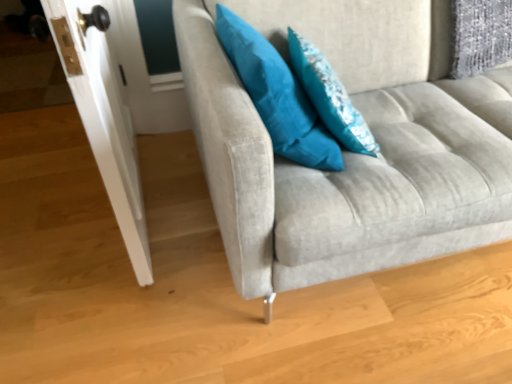
Question: Can you confirm if teal fabric pillow at upper center, the 2th pillow from the left, is taller than teal fabric pillow at upper right, arranged as the second pillow when viewed from the right?

Choices:
 (A) yes
 (B) no

Answer: (B)

Question: Does teal fabric pillow at upper center, the 2th pillow from the left, have a lesser height compared to teal fabric pillow at upper right, the 1th pillow positioned from the left?

Choices:
 (A) no
 (B) yes

Answer: (B)

Question: From the image's perspective, does teal fabric pillow at upper center, positioned as the first pillow in right-to-left order, appear higher than teal fabric pillow at upper right, arranged as the second pillow when viewed from the right?

Choices:
 (A) yes
 (B) no

Answer: (B)

Question: From a real-world perspective, is teal fabric pillow at upper center, the 2th pillow from the left, below teal fabric pillow at upper right, arranged as the second pillow when viewed from the right?

Choices:
 (A) no
 (B) yes

Answer: (B)

Question: From the image's perspective, is teal fabric pillow at upper center, positioned as the first pillow in right-to-left order, located beneath teal fabric pillow at upper right, arranged as the second pillow when viewed from the right?

Choices:
 (A) yes
 (B) no

Answer: (A)

Question: Does teal fabric pillow at upper center, the 2th pillow from the left, have a larger size compared to teal fabric pillow at upper right, arranged as the second pillow when viewed from the right?

Choices:
 (A) yes
 (B) no

Answer: (B)

Question: Considering the relative sizes of teal fabric pillow at upper right, arranged as the second pillow when viewed from the right, and suede gray couch at center in the image provided, is teal fabric pillow at upper right, arranged as the second pillow when viewed from the right, thinner than suede gray couch at center?

Choices:
 (A) yes
 (B) no

Answer: (A)

Question: Does teal fabric pillow at upper right, arranged as the second pillow when viewed from the right, appear on the right side of suede gray couch at center?

Choices:
 (A) yes
 (B) no

Answer: (B)

Question: Can you confirm if teal fabric pillow at upper right, arranged as the second pillow when viewed from the right, is smaller than suede gray couch at center?

Choices:
 (A) no
 (B) yes

Answer: (B)

Question: Is teal fabric pillow at upper right, arranged as the second pillow when viewed from the right, oriented away from suede gray couch at center?

Choices:
 (A) yes
 (B) no

Answer: (A)

Question: Does teal fabric pillow at upper right, the 1th pillow positioned from the left, turn towards suede gray couch at center?

Choices:
 (A) yes
 (B) no

Answer: (A)

Question: From a real-world perspective, is teal fabric pillow at upper right, the 1th pillow positioned from the left, positioned under suede gray couch at center based on gravity?

Choices:
 (A) no
 (B) yes

Answer: (A)

Question: Would you say teal fabric pillow at upper right, arranged as the second pillow when viewed from the right, contains white glossy door at left?

Choices:
 (A) no
 (B) yes

Answer: (A)